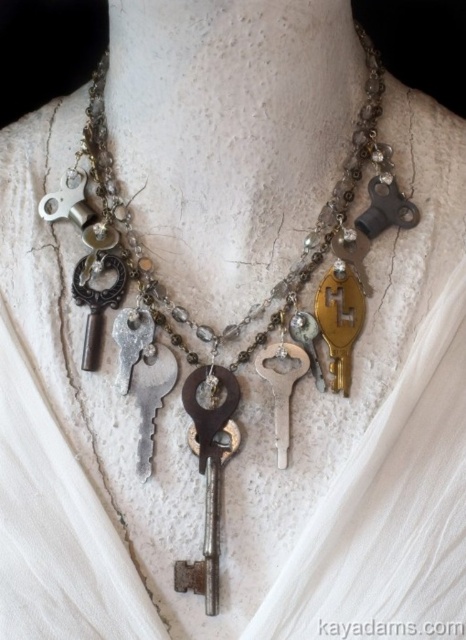
You are a photographer standing 1 meter away from a camera. You want to take a closeup shot of the rusty metal key at center. Is the camera close enough to capture the key in detail without moving closer?

The rusty metal key at center and camera are 97.40 centimeters apart from each other. Since 97.40 cm is approximately 0.97 meters, which is just under 1 meter, the camera is close enough to capture the key in detail without moving closer.